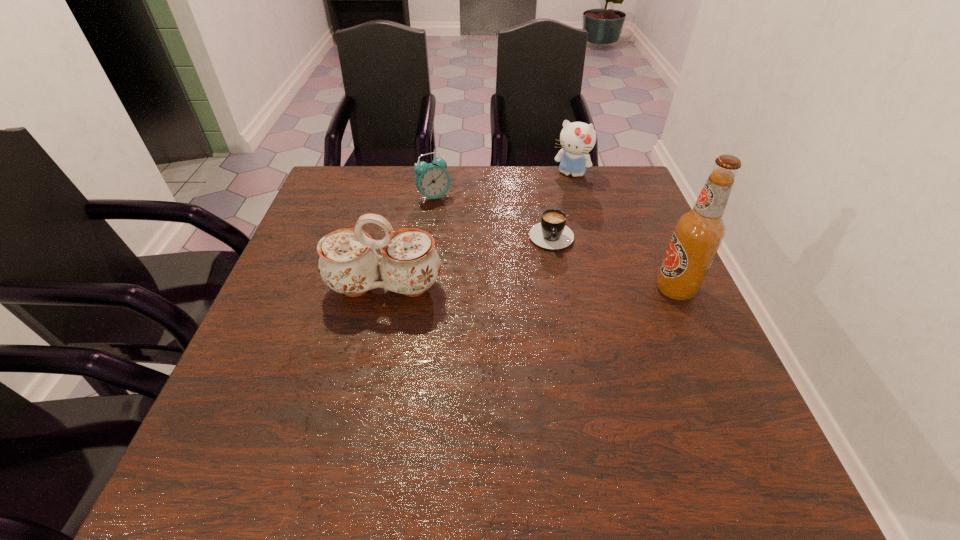
In order to click on vacant area situated on the front-facing side of the kitten in this screenshot , I will do `click(533, 248)`.

The width and height of the screenshot is (960, 540). In order to click on free space located 0.180m on the front-facing side of the kitten in this screenshot , I will do `click(549, 215)`.

Locate an element on the screen. The height and width of the screenshot is (540, 960). vacant space located 0.340m on the front-facing side of the kitten is located at coordinates (532, 251).

Find the location of a particular element. blank area located 0.190m on the face of the alarm clock is located at coordinates (485, 238).

Where is `free space located 0.290m on the face of the alarm clock`? This screenshot has height=540, width=960. free space located 0.290m on the face of the alarm clock is located at coordinates (509, 258).

Where is `free space located 0.060m on the face of the alarm clock`? This screenshot has width=960, height=540. free space located 0.060m on the face of the alarm clock is located at coordinates (456, 213).

Identify the location of free spot located with the handle on the side of the shortest object. (557, 301).

At what (x,y) coordinates should I click in order to perform the action: click on vacant space located with the handle on the side of the shortest object. Please return your answer as a coordinate pair (x, y). The height and width of the screenshot is (540, 960). Looking at the image, I should click on (562, 369).

Locate an element on the screen. The height and width of the screenshot is (540, 960). blank space located with the handle on the side of the shortest object is located at coordinates (558, 326).

Where is `kitten that is at the far edge`? This screenshot has width=960, height=540. kitten that is at the far edge is located at coordinates (577, 139).